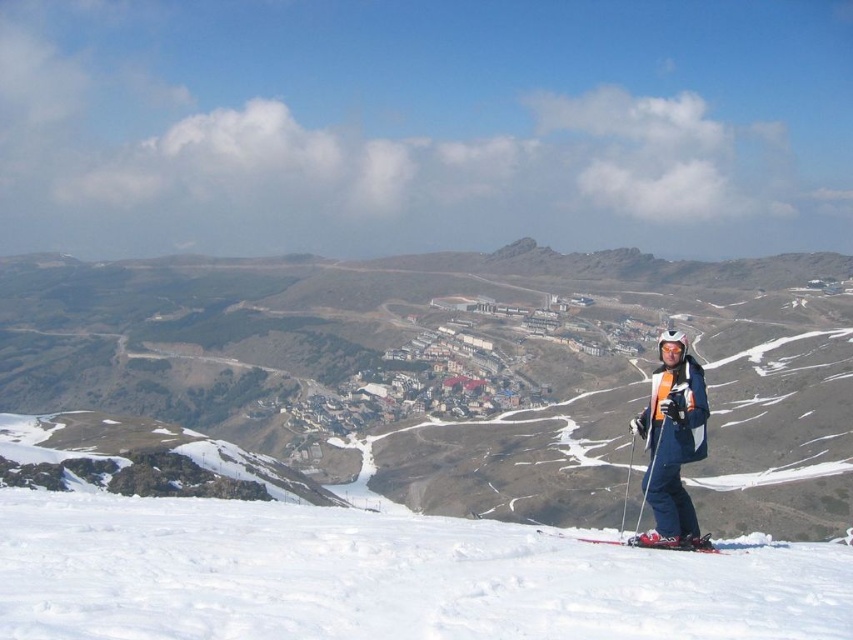
Can you confirm if white powdery snow at lower center is shorter than blue fabric ski suit at lower right?

Indeed, white powdery snow at lower center has a lesser height compared to blue fabric ski suit at lower right.

What do you see at coordinates (381, 577) in the screenshot? I see `white powdery snow at lower center` at bounding box center [381, 577].

Is point (816, 589) behind point (692, 520)?

That is False.

Find the location of a particular element. white powdery snow at lower center is located at coordinates (381, 577).

From the picture: Who is more forward, (730, 618) or (561, 536)?

Point (730, 618)

Does point (218, 627) come in front of point (712, 550)?

That is True.

In order to click on white powdery snow at lower center in this screenshot , I will do `click(381, 577)`.

Can you confirm if blue fabric ski suit at lower right is shorter than shiny metallic ski at lower center?

No.

Between point (674, 534) and point (601, 541), which one is positioned behind?

The point (601, 541) is more distant.

From the picture: Who is more forward, (683, 352) or (694, 540)?

Point (694, 540) is more forward.

Where is `blue fabric ski suit at lower right`? Image resolution: width=853 pixels, height=640 pixels. blue fabric ski suit at lower right is located at coordinates (672, 440).